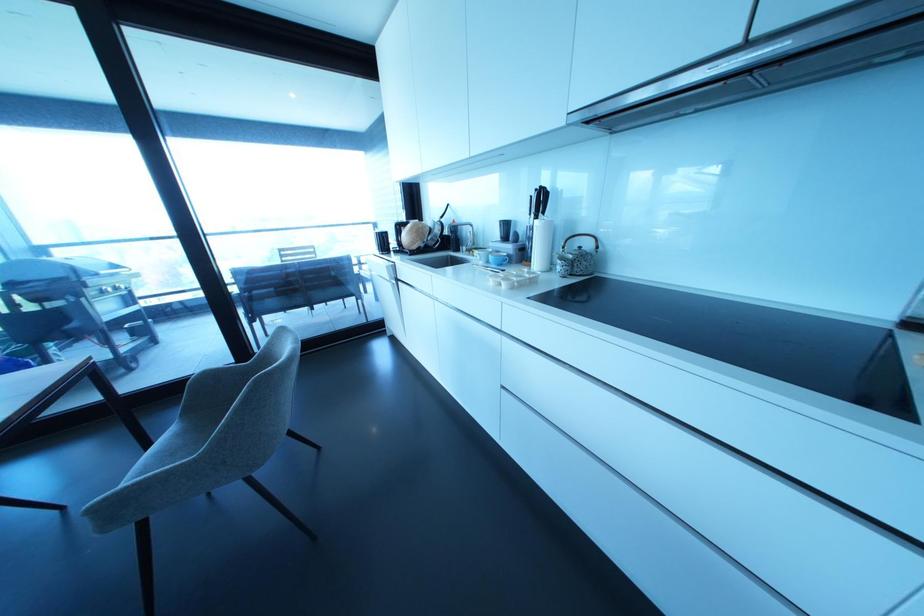
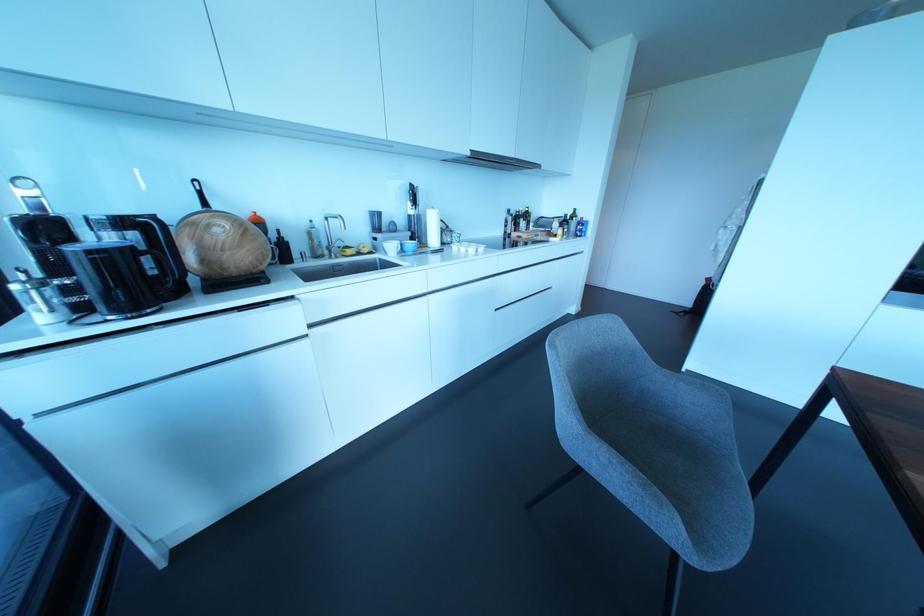
In the second image, find the point that corresponds to (x=441, y=216) in the first image.

(204, 204)